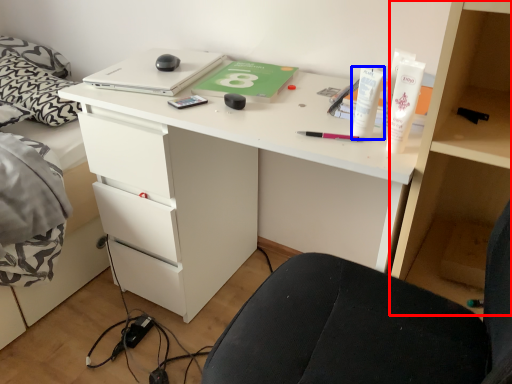
Question: Which object appears closest to the camera in this image, bookshelf (highlighted by a red box) or toiletry (highlighted by a blue box)?

Choices:
 (A) bookshelf
 (B) toiletry

Answer: (A)